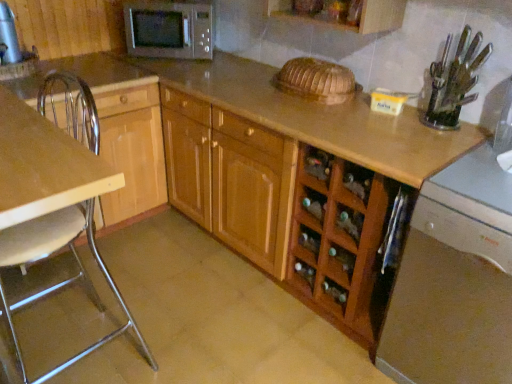
Question: Are wooden cabinet at center, placed as the first cabinetry when sorted from right to left, and wooden cabinet at left, positioned as the second cabinetry in right-to-left order, making contact?

Choices:
 (A) yes
 (B) no

Answer: (B)

Question: Does wooden cabinet at center, placed as the first cabinetry when sorted from right to left, lie in front of wooden cabinet at left, the 1th cabinetry positioned from the left?

Choices:
 (A) no
 (B) yes

Answer: (B)

Question: Is wooden cabinet at left, the 1th cabinetry positioned from the left, inside wooden cabinet at center, which is the second cabinetry from left to right?

Choices:
 (A) no
 (B) yes

Answer: (A)

Question: Is wooden cabinet at center, placed as the first cabinetry when sorted from right to left, shorter than wooden cabinet at left, the 1th cabinetry positioned from the left?

Choices:
 (A) yes
 (B) no

Answer: (B)

Question: From a real-world perspective, is wooden cabinet at center, placed as the first cabinetry when sorted from right to left, under wooden cabinet at left, the 1th cabinetry positioned from the left?

Choices:
 (A) yes
 (B) no

Answer: (B)

Question: Considering the relative positions of wooden cabinet at center, placed as the first cabinetry when sorted from right to left, and wooden cabinet at left, positioned as the second cabinetry in right-to-left order, in the image provided, is wooden cabinet at center, placed as the first cabinetry when sorted from right to left, to the right of wooden cabinet at left, positioned as the second cabinetry in right-to-left order, from the viewer's perspective?

Choices:
 (A) no
 (B) yes

Answer: (B)

Question: Is the position of metallic silver chair at left more distant than that of wooden cabinet at left, the 1th cabinetry positioned from the left?

Choices:
 (A) no
 (B) yes

Answer: (A)

Question: From a real-world perspective, is metallic silver chair at left under wooden cabinet at left, positioned as the second cabinetry in right-to-left order?

Choices:
 (A) yes
 (B) no

Answer: (B)

Question: Does metallic silver chair at left appear on the left side of wooden cabinet at left, positioned as the second cabinetry in right-to-left order?

Choices:
 (A) no
 (B) yes

Answer: (B)

Question: From the image's perspective, is metallic silver chair at left on top of wooden cabinet at left, positioned as the second cabinetry in right-to-left order?

Choices:
 (A) no
 (B) yes

Answer: (A)

Question: Is metallic silver chair at left completely or partially outside of wooden cabinet at left, positioned as the second cabinetry in right-to-left order?

Choices:
 (A) no
 (B) yes

Answer: (B)

Question: Considering the relative sizes of metallic silver chair at left and wooden cabinet at left, positioned as the second cabinetry in right-to-left order, in the image provided, is metallic silver chair at left smaller than wooden cabinet at left, positioned as the second cabinetry in right-to-left order,?

Choices:
 (A) yes
 (B) no

Answer: (B)

Question: Can you confirm if clear plastic knife block at upper right, the first appliance in the right-to-left sequence, is taller than wooden cabinet at left, positioned as the second cabinetry in right-to-left order?

Choices:
 (A) yes
 (B) no

Answer: (B)